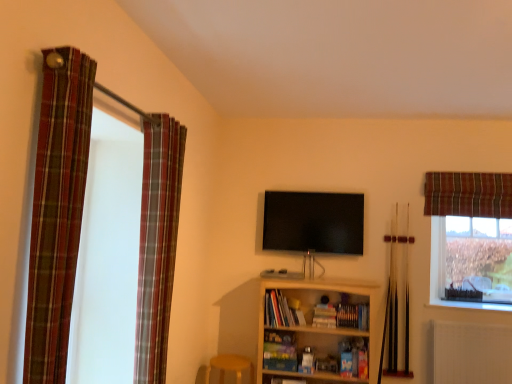
Question: Does clear glass window at upper right have a greater height compared to flat screen tv at center?

Choices:
 (A) yes
 (B) no

Answer: (A)

Question: Considering the relative sizes of clear glass window at upper right and flat screen tv at center in the image provided, is clear glass window at upper right wider than flat screen tv at center?

Choices:
 (A) yes
 (B) no

Answer: (A)

Question: Can you confirm if clear glass window at upper right is bigger than flat screen tv at center?

Choices:
 (A) no
 (B) yes

Answer: (B)

Question: Does clear glass window at upper right have a smaller size compared to flat screen tv at center?

Choices:
 (A) yes
 (B) no

Answer: (B)

Question: Does clear glass window at upper right appear on the left side of flat screen tv at center?

Choices:
 (A) yes
 (B) no

Answer: (B)

Question: Is light wood bookshelf at center to the left or to the right of hardcover books at center, which is the 1th book in left-to-right order, in the image?

Choices:
 (A) right
 (B) left

Answer: (A)

Question: Is light wood bookshelf at center spatially inside hardcover books at center, the second book viewed from the right, or outside of it?

Choices:
 (A) outside
 (B) inside

Answer: (A)

Question: From the image's perspective, is light wood bookshelf at center above or below hardcover books at center, which is the 1th book in left-to-right order?

Choices:
 (A) below
 (B) above

Answer: (A)

Question: In terms of height, does light wood bookshelf at center look taller or shorter compared to hardcover books at center, which is the 1th book in left-to-right order?

Choices:
 (A) short
 (B) tall

Answer: (B)

Question: In the image, is clear glass window at upper right positioned in front of or behind light wood bookshelf at center?

Choices:
 (A) front
 (B) behind

Answer: (B)

Question: In the image, is clear glass window at upper right on the left side or the right side of light wood bookshelf at center?

Choices:
 (A) left
 (B) right

Answer: (B)

Question: Choose the correct answer: Is clear glass window at upper right inside light wood bookshelf at center or outside it?

Choices:
 (A) inside
 (B) outside

Answer: (B)

Question: Looking at their shapes, would you say clear glass window at upper right is wider or thinner than light wood bookshelf at center?

Choices:
 (A) thin
 (B) wide

Answer: (A)

Question: Considering the positions of plaid fabric curtain at left, the second curtain when ordered from left to right, and plaid fabric curtain at upper right, positioned as the 1th curtain in back-to-front order, in the image, is plaid fabric curtain at left, the second curtain when ordered from left to right, bigger or smaller than plaid fabric curtain at upper right, positioned as the 1th curtain in back-to-front order,?

Choices:
 (A) big
 (B) small

Answer: (A)

Question: Visually, is plaid fabric curtain at left, which is counted as the second curtain, starting from the back, positioned to the left or to the right of plaid fabric curtain at upper right, arranged as the third curtain when viewed from the front?

Choices:
 (A) left
 (B) right

Answer: (A)